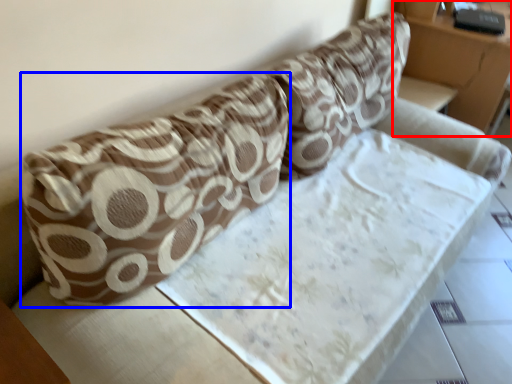
Question: Which point is closer to the camera, furniture (highlighted by a red box) or throw pillow (highlighted by a blue box)?

Choices:
 (A) furniture
 (B) throw pillow

Answer: (B)